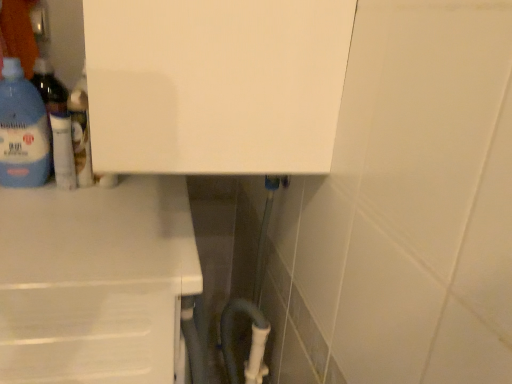
Question: From the image's perspective, is white glossy lotion at upper left, the 2th bottle when ordered from left to right, on top of white matte counter at lower left?

Choices:
 (A) yes
 (B) no

Answer: (A)

Question: From the image's perspective, is white glossy lotion at upper left, the 2th bottle when ordered from left to right, below white matte counter at lower left?

Choices:
 (A) no
 (B) yes

Answer: (A)

Question: Is white glossy lotion at upper left, the 2th bottle when ordered from left to right, smaller than white matte counter at lower left?

Choices:
 (A) yes
 (B) no

Answer: (A)

Question: Is there a large distance between white glossy lotion at upper left, marked as the 1th bottle in a right-to-left arrangement, and white matte counter at lower left?

Choices:
 (A) yes
 (B) no

Answer: (B)

Question: Does white glossy lotion at upper left, the 2th bottle when ordered from left to right, have a greater width compared to white matte counter at lower left?

Choices:
 (A) yes
 (B) no

Answer: (B)

Question: Considering the positions of white glossy lotion at upper left, the 2th bottle when ordered from left to right, and translucent plastic bottle at left, which appears as the 1th bottle when viewed from the left, in the image, is white glossy lotion at upper left, the 2th bottle when ordered from left to right, wider or thinner than translucent plastic bottle at left, which appears as the 1th bottle when viewed from the left,?

Choices:
 (A) wide
 (B) thin

Answer: (B)

Question: In the image, is white glossy lotion at upper left, the 2th bottle when ordered from left to right, positioned in front of or behind translucent plastic bottle at left, which appears as the 1th bottle when viewed from the left?

Choices:
 (A) front
 (B) behind

Answer: (B)

Question: Is white glossy lotion at upper left, the 2th bottle when ordered from left to right, to the left or to the right of translucent plastic bottle at left, which appears as the 1th bottle when viewed from the left, in the image?

Choices:
 (A) left
 (B) right

Answer: (B)

Question: Considering the positions of white glossy lotion at upper left, the 2th bottle when ordered from left to right, and translucent plastic bottle at left, which appears as the 1th bottle when viewed from the left, in the image, is white glossy lotion at upper left, the 2th bottle when ordered from left to right, taller or shorter than translucent plastic bottle at left, which appears as the 1th bottle when viewed from the left,?

Choices:
 (A) short
 (B) tall

Answer: (A)

Question: Choose the correct answer: Is translucent plastic bottle at left, which appears as the 1th bottle when viewed from the left, inside white matte counter at lower left or outside it?

Choices:
 (A) outside
 (B) inside

Answer: (A)

Question: From a real-world perspective, is translucent plastic bottle at left, the 2th bottle positioned from the right, above or below white matte counter at lower left?

Choices:
 (A) above
 (B) below

Answer: (A)

Question: Considering the positions of point (5, 124) and point (105, 291), is point (5, 124) closer or farther from the camera than point (105, 291)?

Choices:
 (A) closer
 (B) farther

Answer: (B)

Question: In the image, is translucent plastic bottle at left, the 2th bottle positioned from the right, on the left side or the right side of white matte counter at lower left?

Choices:
 (A) left
 (B) right

Answer: (A)

Question: From a real-world perspective, is white glossy lotion at upper left, marked as the 1th bottle in a right-to-left arrangement, above or below white matte counter at lower left?

Choices:
 (A) above
 (B) below

Answer: (A)

Question: From the image's perspective, is white glossy lotion at upper left, the 2th bottle when ordered from left to right, located above or below white matte counter at lower left?

Choices:
 (A) below
 (B) above

Answer: (B)